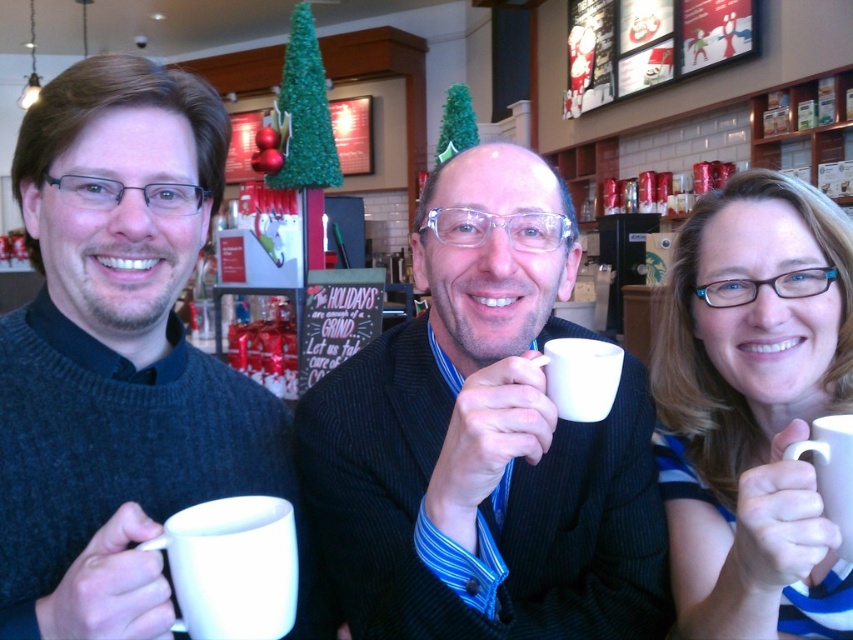
Where is `white matte mug at left`? white matte mug at left is located at coordinates (115, 355).

Can you confirm if white matte mug at left is positioned to the left of white matte mug at center?

Correct, you'll find white matte mug at left to the left of white matte mug at center.

Which is behind, point (138, 552) or point (556, 342)?

Point (556, 342)

Locate an element on the screen. Image resolution: width=853 pixels, height=640 pixels. white matte mug at left is located at coordinates (115, 355).

Between blue striped shirt at right and white matte mug at lower left, which one appears on the right side from the viewer's perspective?

Positioned to the right is blue striped shirt at right.

How distant is blue striped shirt at right from white matte mug at lower left?

blue striped shirt at right is 18.98 inches away from white matte mug at lower left.

Where is `blue striped shirt at right`? The image size is (853, 640). blue striped shirt at right is located at coordinates (753, 408).

Can you confirm if blue striped shirt at right is bigger than white matte mug at right?

Yes, blue striped shirt at right is bigger than white matte mug at right.

Which is below, blue striped shirt at right or white matte mug at right?

Positioned lower is white matte mug at right.

Who is more distant from viewer, (802,272) or (815,422)?

Point (802,272)

Find the location of a particular element. blue striped shirt at right is located at coordinates (753, 408).